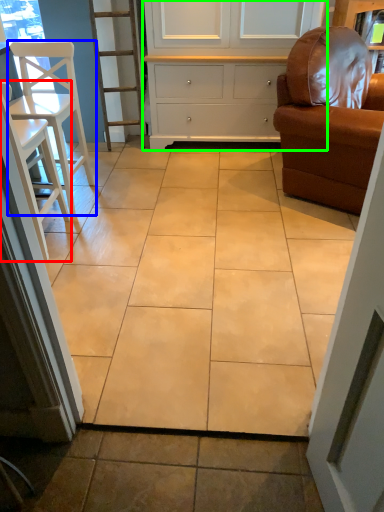
Question: Which object is the closest to the chair (highlighted by a red box)? Choose among these: chair (highlighted by a blue box) or cabinetry (highlighted by a green box).

Choices:
 (A) chair
 (B) cabinetry

Answer: (A)